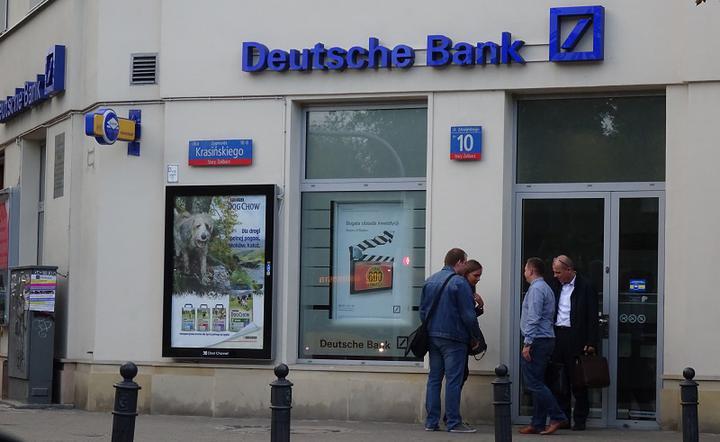
This screenshot has width=720, height=442. I want to click on wall, so click(703, 284).